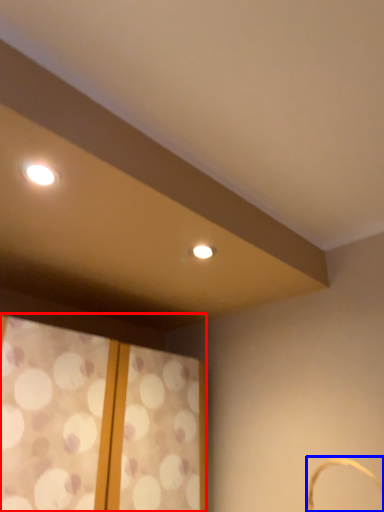
Question: Among these objects, which one is nearest to the camera, window (highlighted by a red box) or basket (highlighted by a blue box)?

Choices:
 (A) window
 (B) basket

Answer: (B)